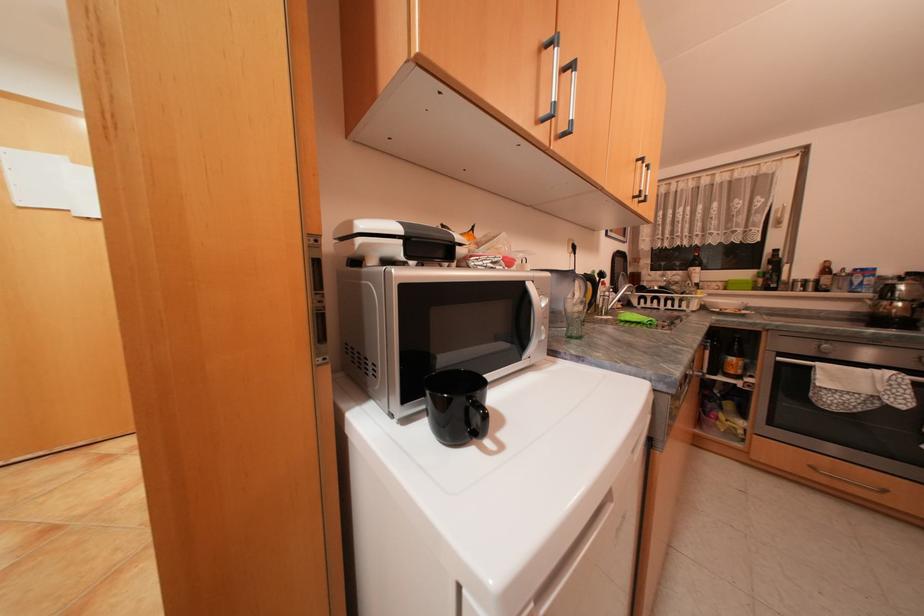
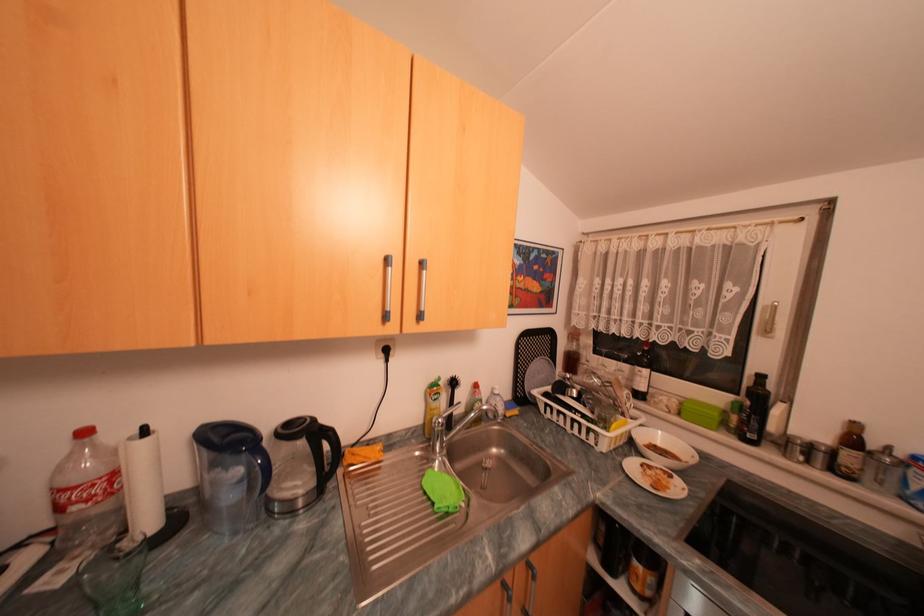
In the second image, find the point that corresponds to point (776, 280) in the first image.

(752, 422)